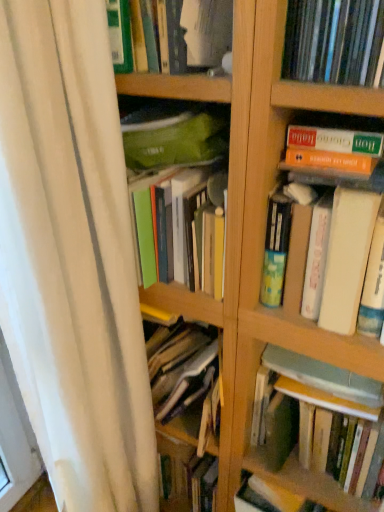
Question: Can you confirm if hardcover book at center, acting as the 1th book starting from the bottom, is positioned to the right of white fabric shower curtain at left?

Choices:
 (A) no
 (B) yes

Answer: (B)

Question: Does hardcover book at center, arranged as the 4th book when viewed from the top, have a lesser width compared to white fabric shower curtain at left?

Choices:
 (A) yes
 (B) no

Answer: (B)

Question: From the image's perspective, is hardcover book at center, acting as the 1th book starting from the bottom, located beneath white fabric shower curtain at left?

Choices:
 (A) no
 (B) yes

Answer: (B)

Question: Is hardcover book at center, acting as the 1th book starting from the bottom, positioned behind white fabric shower curtain at left?

Choices:
 (A) yes
 (B) no

Answer: (A)

Question: Does hardcover book at center, acting as the 1th book starting from the bottom, have a smaller size compared to white fabric shower curtain at left?

Choices:
 (A) no
 (B) yes

Answer: (B)

Question: In terms of size, does matte plastic books at upper right, the 2th book positioned from the top, appear bigger or smaller than green matte book at upper center, marked as the 4th book in a bottom-to-top arrangement?

Choices:
 (A) big
 (B) small

Answer: (B)

Question: Would you say matte plastic books at upper right, the 3th book positioned from the bottom, is to the left or to the right of green matte book at upper center, marked as the 4th book in a bottom-to-top arrangement, in the picture?

Choices:
 (A) left
 (B) right

Answer: (B)

Question: Is point [x=377, y=8] positioned closer to the camera than point [x=198, y=16]?

Choices:
 (A) farther
 (B) closer

Answer: (B)

Question: Is matte plastic books at upper right, the 2th book positioned from the top, taller or shorter than green matte book at upper center, arranged as the first book when viewed from the top?

Choices:
 (A) short
 (B) tall

Answer: (A)

Question: Considering the positions of point (16, 114) and point (163, 29), is point (16, 114) closer or farther from the camera than point (163, 29)?

Choices:
 (A) farther
 (B) closer

Answer: (B)

Question: From the image's perspective, is white fabric shower curtain at left located above or below green matte book at upper center, marked as the 4th book in a bottom-to-top arrangement?

Choices:
 (A) below
 (B) above

Answer: (A)

Question: Visually, is white fabric shower curtain at left positioned to the left or to the right of green matte book at upper center, marked as the 4th book in a bottom-to-top arrangement?

Choices:
 (A) left
 (B) right

Answer: (A)

Question: Relative to green matte book at upper center, marked as the 4th book in a bottom-to-top arrangement, is white fabric shower curtain at left in front or behind?

Choices:
 (A) behind
 (B) front

Answer: (B)

Question: Is green matte book at upper center, marked as the 4th book in a bottom-to-top arrangement, spatially inside white fabric shower curtain at left, or outside of it?

Choices:
 (A) inside
 (B) outside

Answer: (B)

Question: Considering the positions of point [173, 25] and point [86, 16], is point [173, 25] closer or farther from the camera than point [86, 16]?

Choices:
 (A) closer
 (B) farther

Answer: (B)